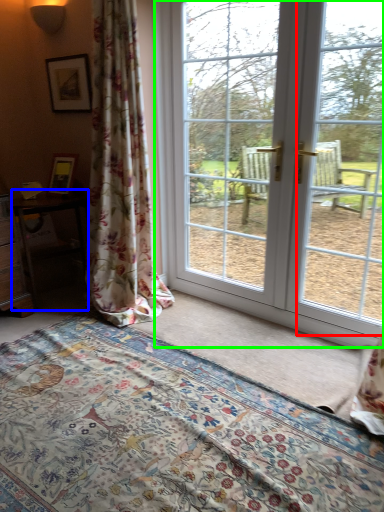
Question: Which is farther away from window screen (highlighted by a red box)? table (highlighted by a blue box) or door (highlighted by a green box)?

Choices:
 (A) table
 (B) door

Answer: (A)